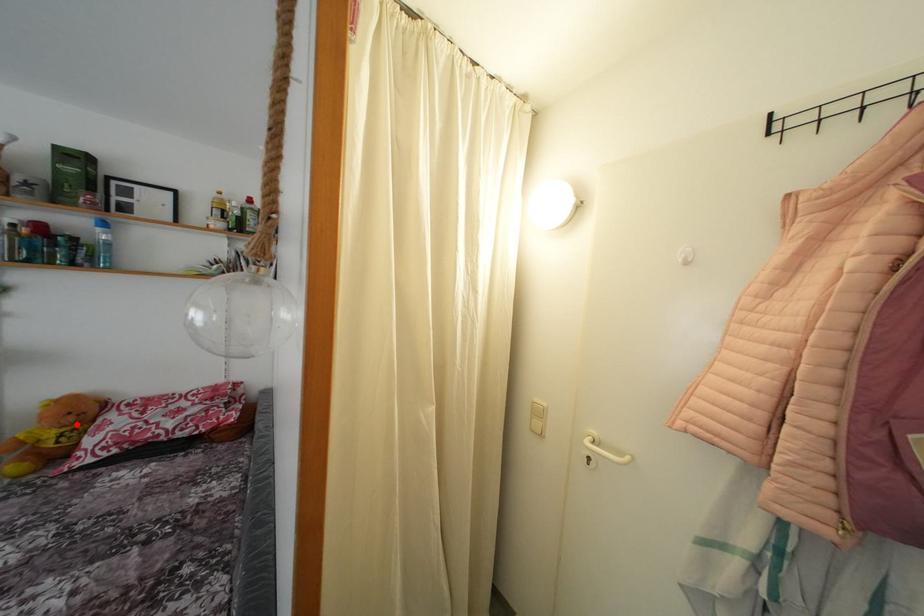
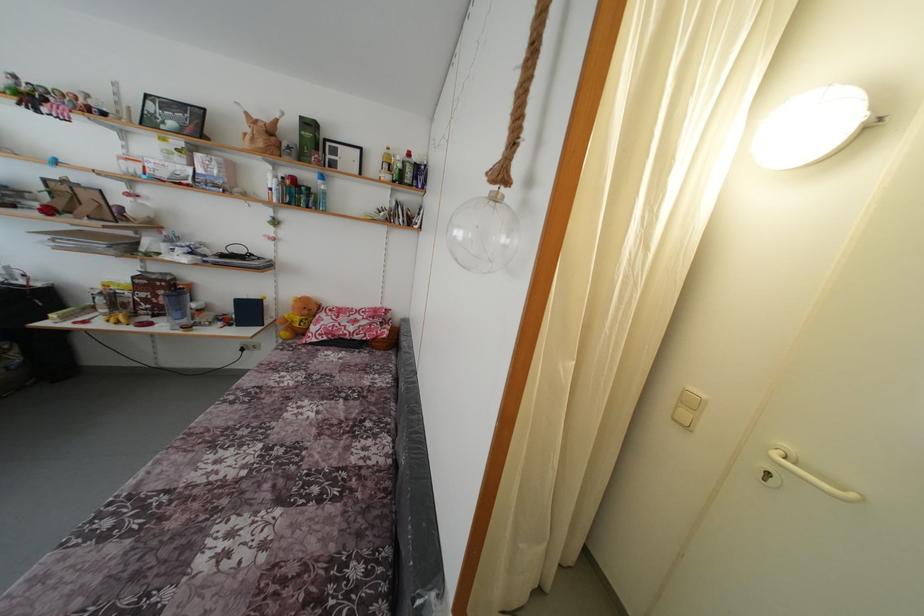
Question: I am providing you with two images of the same scene from different viewpoints. A red point is shown in image1. For the corresponding object point in image2, is it positioned nearer or farther from the camera?

Choices:
 (A) Nearer
 (B) Farther

Answer: (B)